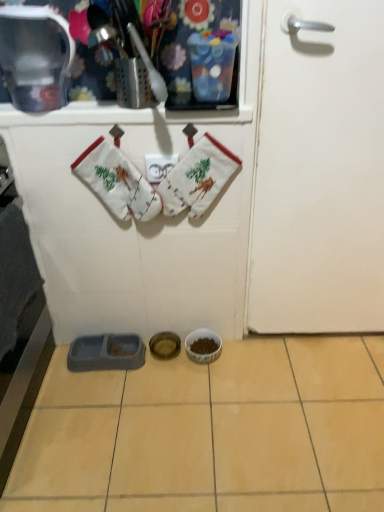
The width and height of the screenshot is (384, 512). Find the location of `vacant space underneath metallic silver container at upper left (from a real-world perspective)`. vacant space underneath metallic silver container at upper left (from a real-world perspective) is located at coordinates (44, 106).